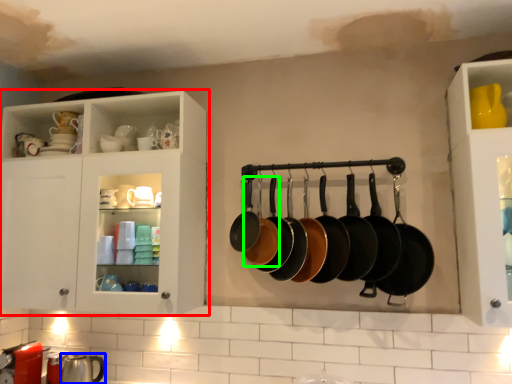
Question: Which object is the closest to the cabinetry (highlighted by a red box)? Choose among these: tableware (highlighted by a blue box) or frying pan (highlighted by a green box).

Choices:
 (A) tableware
 (B) frying pan

Answer: (B)